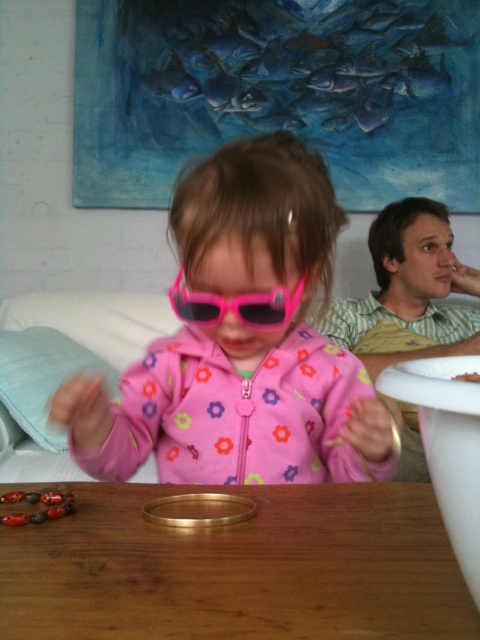
You are a photographer trying to capture a closeup of the green striped shirt at upper right. The camera you are using has a minimum focusing distance of 4 feet. Can you take the photo without moving closer than 4 feet?

The photographer can take the closeup of the green striped shirt at upper right without moving closer than 4 feet since they are 4.21 feet apart, which is within the camera s minimum focusing distance.

You are a photographer trying to capture a closeup of the pink matte sunglasses at center and the light blue fabric pillow at lower left. Since you want to focus on the sunglasses, which object should you zoom in on first?

The pink matte sunglasses at center is larger in size than the light blue fabric pillow at lower left, so you should zoom in on the pink matte sunglasses at center first to ensure it fills the frame appropriately.